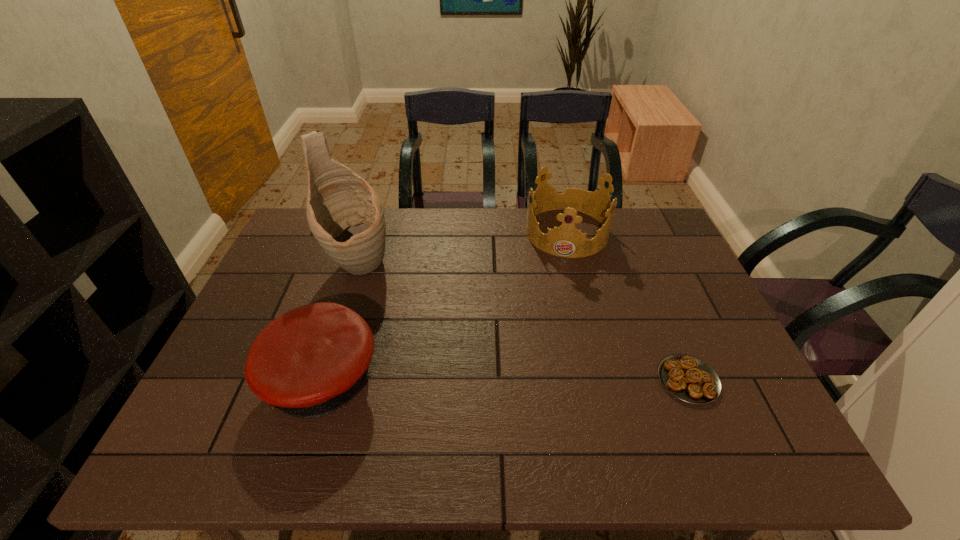
The width and height of the screenshot is (960, 540). In order to click on object present at the right edge in this screenshot , I will do `click(688, 378)`.

I want to click on object at the far left corner, so click(346, 216).

Image resolution: width=960 pixels, height=540 pixels. I want to click on object that is positioned at the near left corner, so click(x=309, y=362).

Locate an element on the screen. This screenshot has width=960, height=540. object located at the near right corner is located at coordinates (688, 378).

Locate an element on the screen. free spot at the far edge of the desktop is located at coordinates (507, 237).

The image size is (960, 540). What are the coordinates of `vacant region at the left edge of the desktop` in the screenshot? It's located at (239, 376).

In the image, there is a desktop. At what (x,y) coordinates should I click in order to perform the action: click on vacant space at the far left corner. Please return your answer as a coordinate pair (x, y). Image resolution: width=960 pixels, height=540 pixels. Looking at the image, I should click on coord(290,235).

Image resolution: width=960 pixels, height=540 pixels. I want to click on vacant space at the far right corner, so click(x=658, y=252).

Find the location of a particular element. vacant region between the pitcher and the second tallest object is located at coordinates (463, 249).

The width and height of the screenshot is (960, 540). I want to click on free space between the third shortest object and the shortest object, so coord(628,306).